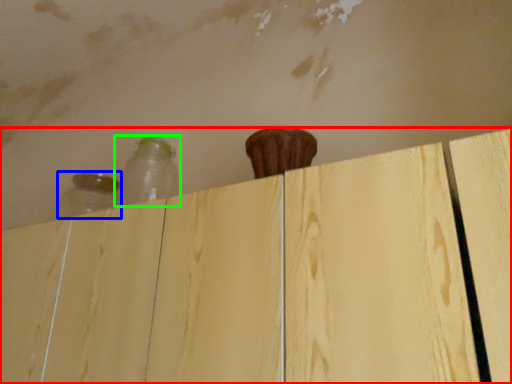
Question: Based on their relative distances, which object is farther from dresser (highlighted by a red box)? Choose from bottle (highlighted by a blue box) and bottle (highlighted by a green box).

Choices:
 (A) bottle
 (B) bottle

Answer: (A)